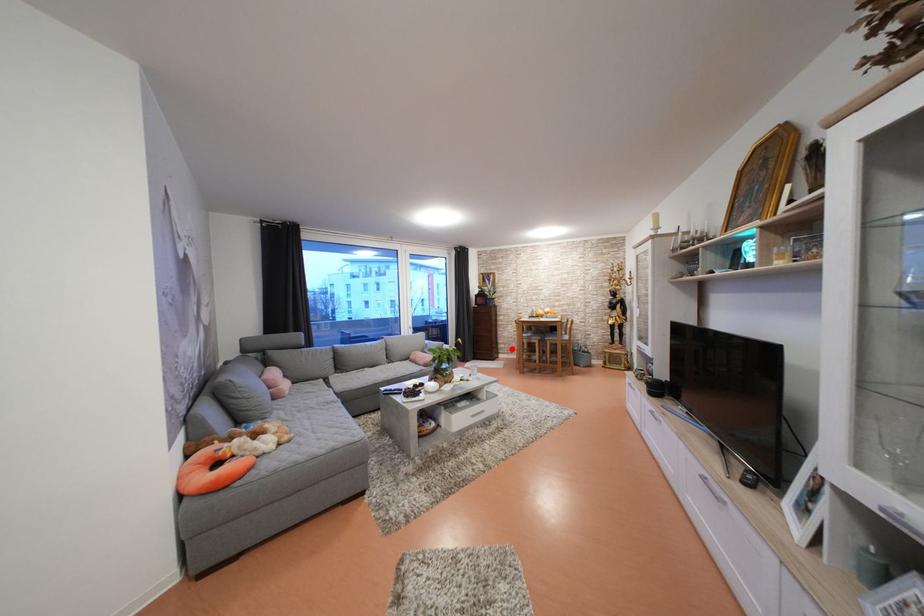
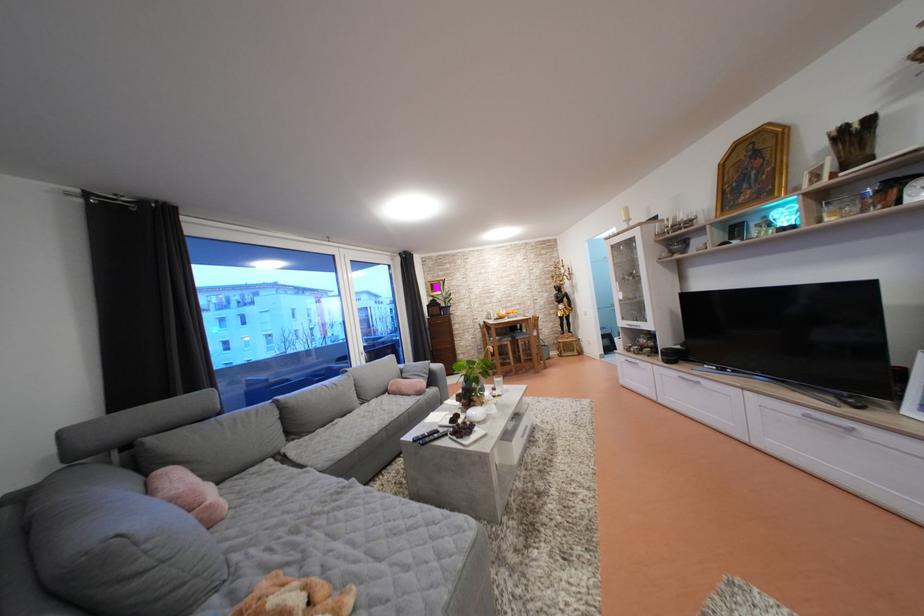
The point at the highlighted location is marked in the first image. Where is the corresponding point in the second image?

(470, 359)